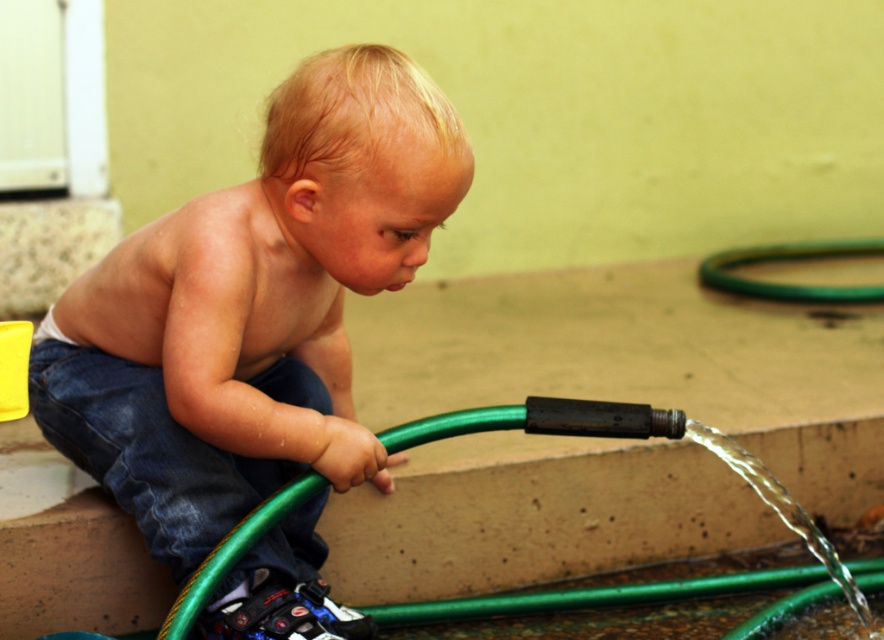
Question: Which point is closer to the camera?

Choices:
 (A) (166, 484)
 (B) (376, 444)
 (C) (728, 278)

Answer: (B)

Question: Which object is farther from the camera taking this photo?

Choices:
 (A) denim at left
 (B) green rubber hose at lower right
 (C) smooth denim jeans at left

Answer: (B)

Question: Can you confirm if smooth denim jeans at left is thinner than green rubber hose at lower right?

Choices:
 (A) yes
 (B) no

Answer: (B)

Question: Can you confirm if denim at left is thinner than green rubber hose at lower right?

Choices:
 (A) no
 (B) yes

Answer: (B)

Question: Considering the relative positions of smooth denim jeans at left and green rubber hose at lower right in the image provided, where is smooth denim jeans at left located with respect to green rubber hose at lower right?

Choices:
 (A) below
 (B) above

Answer: (A)

Question: Estimate the real-world distances between objects in this image. Which object is closer to the denim at left?

Choices:
 (A) green rubber hose at lower right
 (B) smooth denim jeans at left

Answer: (B)